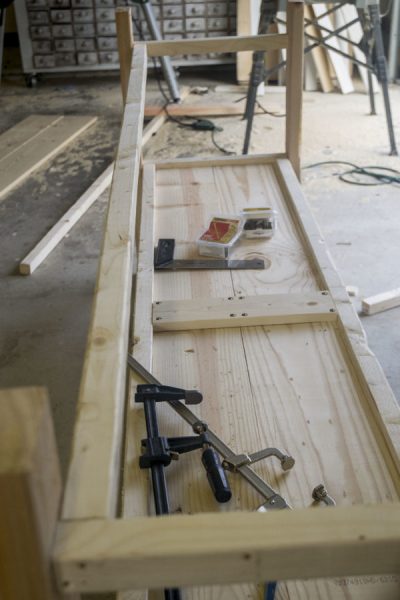
You are a GUI agent. You are given a task and a screenshot of the screen. Output one action in this format:
    pyautogui.click(x=<x>, y=<y>)
    Task: Click on the metal shelving with small drawers
    
    Given the screenshot: What is the action you would take?
    pos(85,36)